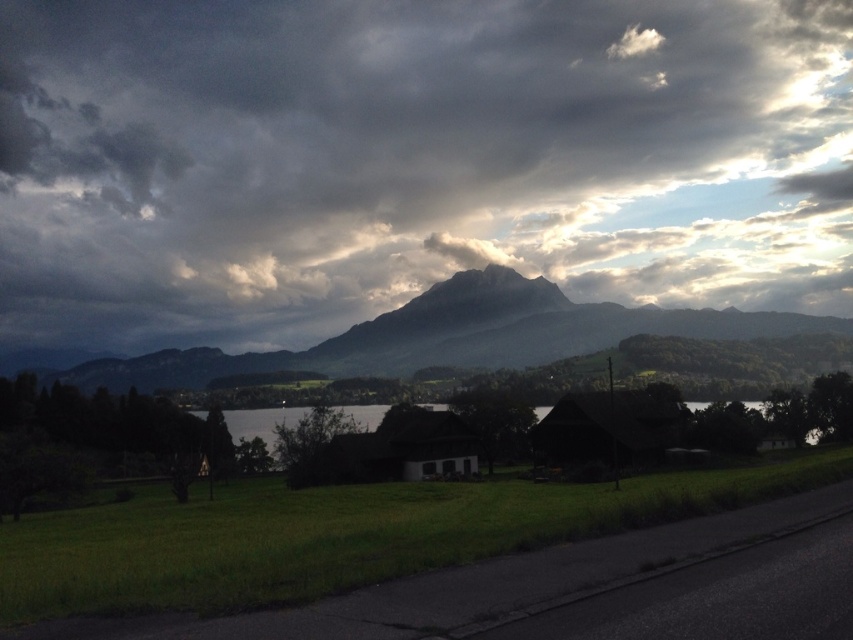
The width and height of the screenshot is (853, 640). Describe the element at coordinates (410, 160) in the screenshot. I see `dark gray cloud at upper center` at that location.

Which is behind, point (428, 97) or point (198, 378)?

Positioned behind is point (428, 97).

The image size is (853, 640). What are the coordinates of `dark gray cloud at upper center` in the screenshot? It's located at (410, 160).

Who is lower down, rugged granite mountain at center or transparent water at center?

transparent water at center is lower down.

In the scene shown: Who is more forward, (184, 353) or (292, 419)?

Point (292, 419) is more forward.

What are the coordinates of `rugged granite mountain at center` in the screenshot? It's located at (x=454, y=336).

Does dark gray cloud at upper center have a smaller size compared to transparent water at center?

Incorrect, dark gray cloud at upper center is not smaller in size than transparent water at center.

Is dark gray cloud at upper center positioned at the back of transparent water at center?

Yes, it is behind transparent water at center.

The width and height of the screenshot is (853, 640). I want to click on dark gray cloud at upper center, so click(410, 160).

You are a GUI agent. You are given a task and a screenshot of the screen. Output one action in this format:
    pyautogui.click(x=<x>, y=<y>)
    Task: Click on the dark gray cloud at upper center
    The image size is (853, 640).
    Given the screenshot: What is the action you would take?
    pyautogui.click(x=410, y=160)